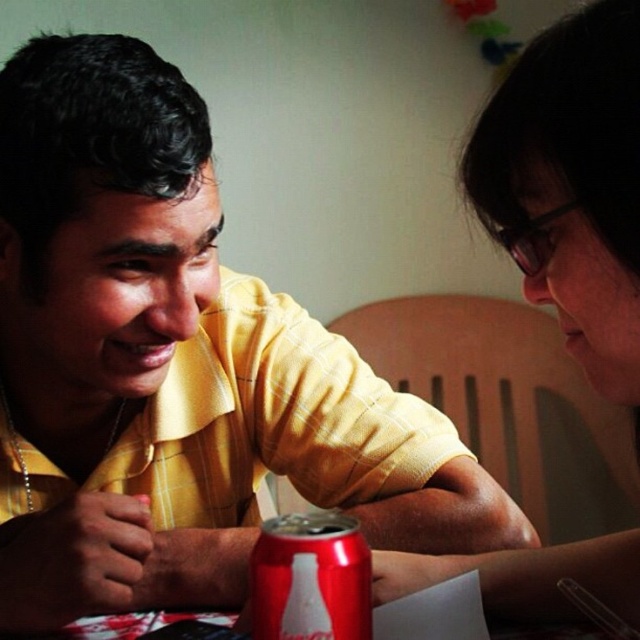
Is point (595, 595) positioned before point (292, 589)?

No, it is not.

Can you confirm if matte black glasses at upper right is shorter than red matte can at center?

No, matte black glasses at upper right is not shorter than red matte can at center.

Is point (637, 548) behind point (321, 531)?

That is True.

At what (x,y) coordinates should I click in order to perform the action: click on matte black glasses at upper right. Please return your answer as a coordinate pair (x, y). Image resolution: width=640 pixels, height=640 pixels. Looking at the image, I should click on (572, 186).